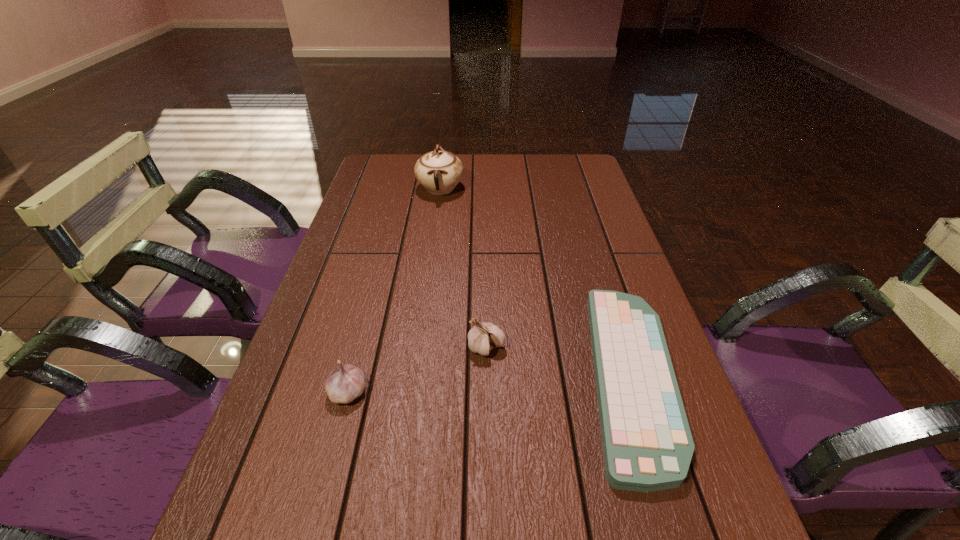
Locate an element on the screen. chinaware is located at coordinates (439, 171).

The width and height of the screenshot is (960, 540). In order to click on the farthest object in this screenshot , I will do `click(439, 171)`.

Where is `the farther garlic`? This screenshot has width=960, height=540. the farther garlic is located at coordinates (483, 337).

I want to click on the second object from right to left, so click(483, 337).

The height and width of the screenshot is (540, 960). What are the coordinates of `the leftmost object` in the screenshot? It's located at (346, 382).

Identify the location of the left garlic. The image size is (960, 540). (346, 382).

Identify the location of computer keyboard. (647, 444).

The image size is (960, 540). What are the coordinates of `the rightmost object` in the screenshot? It's located at (647, 444).

Locate an element on the screen. The width and height of the screenshot is (960, 540). free space located 0.330m on the front of the farthest object is located at coordinates (429, 274).

This screenshot has height=540, width=960. Find the location of `vacant space positioned on the left of the farther garlic`. vacant space positioned on the left of the farther garlic is located at coordinates (304, 348).